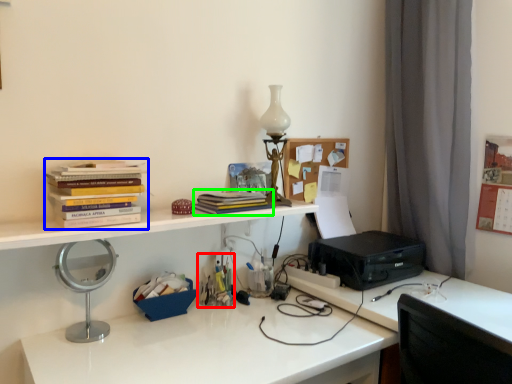
Question: Based on their relative distances, which object is farther from stationery (highlighted by a red box)? Choose from book (highlighted by a blue box) and book (highlighted by a green box).

Choices:
 (A) book
 (B) book

Answer: (A)